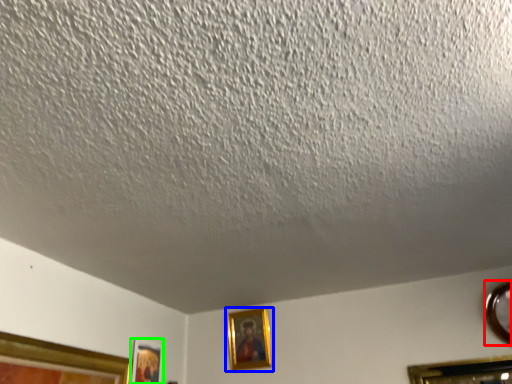
Question: Which is nearer to the picture frame (highlighted by a red box)? picture frame (highlighted by a blue box) or picture frame (highlighted by a green box).

Choices:
 (A) picture frame
 (B) picture frame

Answer: (A)